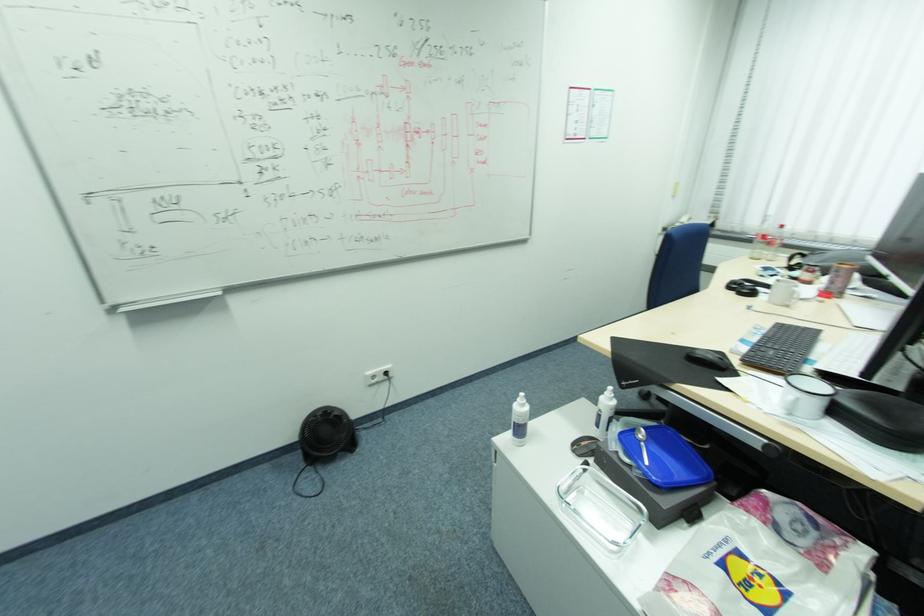
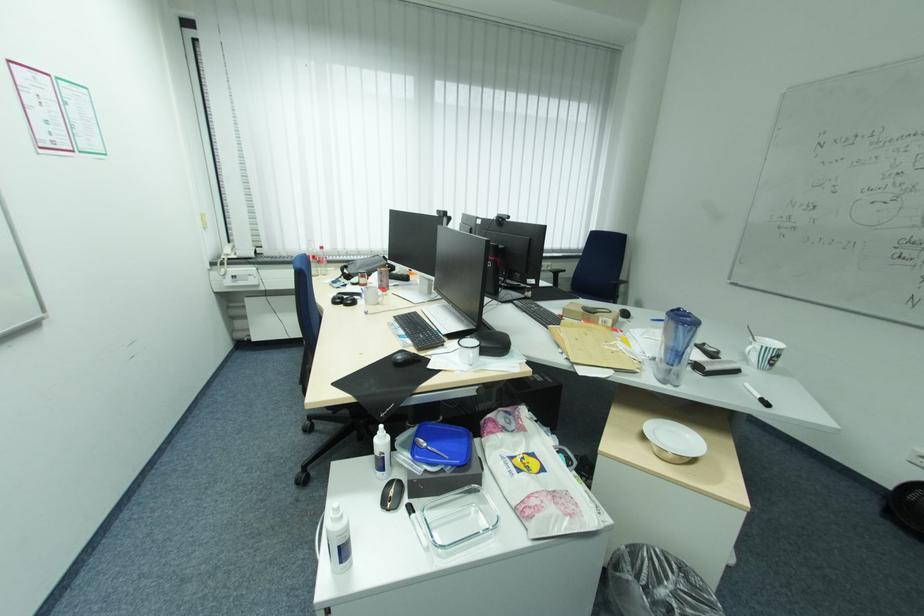
Locate, in the second image, the point that corresponds to the point at 796,397 in the first image.

(478, 355)